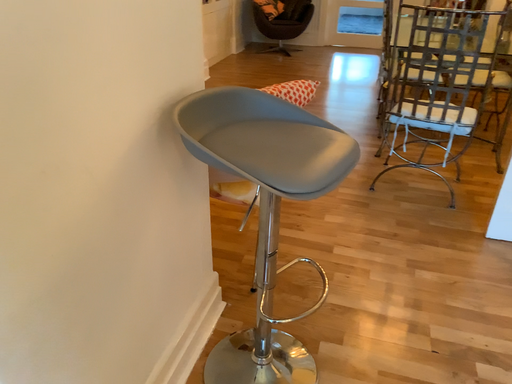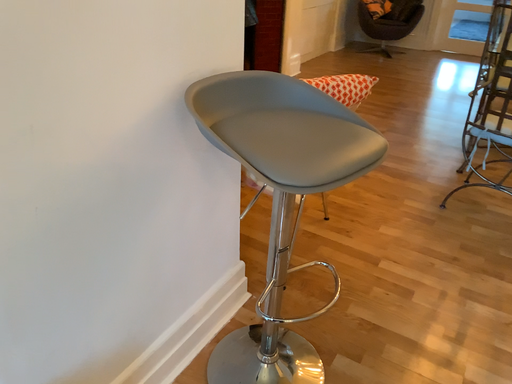
Question: Which way did the camera rotate in the video?

Choices:
 (A) rotated left
 (B) rotated right

Answer: (A)